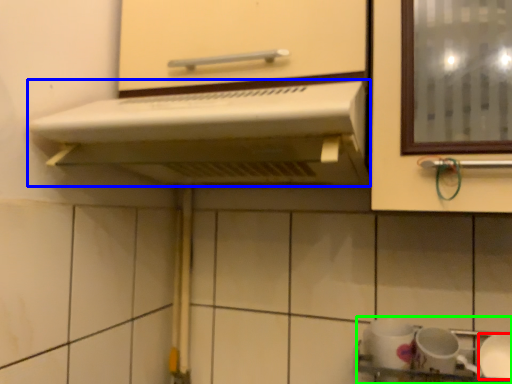
Question: Which object is positioned farthest from tableware (highlighted by a red box)? Select from home appliance (highlighted by a blue box) and sink (highlighted by a green box).

Choices:
 (A) home appliance
 (B) sink

Answer: (A)